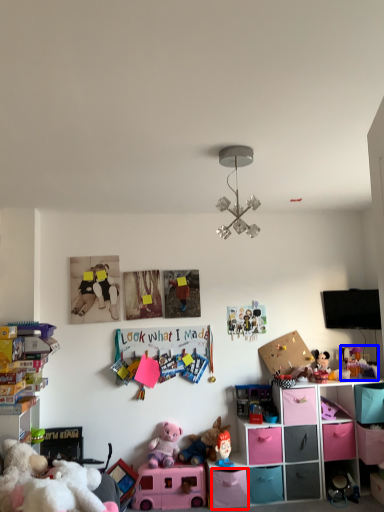
Question: Which of the following is the farthest to the observer, drawer (highlighted by a red box) or toy (highlighted by a blue box)?

Choices:
 (A) drawer
 (B) toy

Answer: (B)